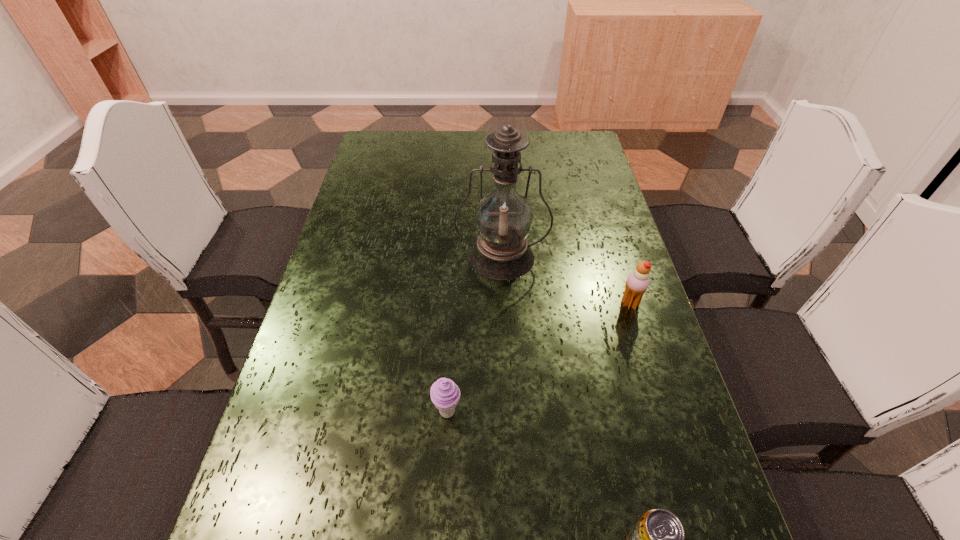
I want to click on unoccupied position between the shorter icecream and the tallest object, so click(474, 335).

Identify which object is the second closest to the second nearest object. Please provide its 2D coordinates. Your answer should be formatted as a tuple, i.e. [(x, y)], where the tuple contains the x and y coordinates of a point satisfying the conditions above.

[(503, 218)]

Locate an element on the screen. This screenshot has width=960, height=540. object identified as the second closest to the oil lamp is located at coordinates (445, 394).